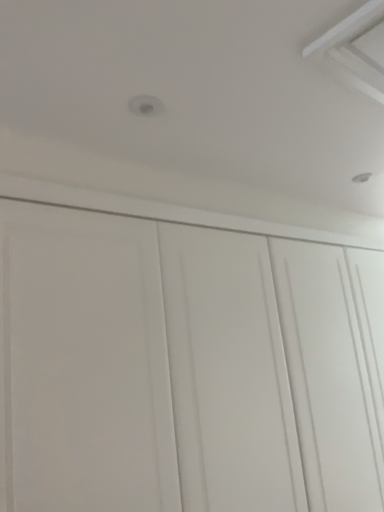
This screenshot has height=512, width=384. Describe the element at coordinates (172, 367) in the screenshot. I see `white matte cupboard at center` at that location.

What is the approximate height of white matte cupboard at center?

5.77 feet.

What is the approximate width of white matte cupboard at center?

25.43 inches.

I want to click on white matte cupboard at center, so click(172, 367).

Where is `white matte cupboard at center`? The width and height of the screenshot is (384, 512). white matte cupboard at center is located at coordinates (172, 367).